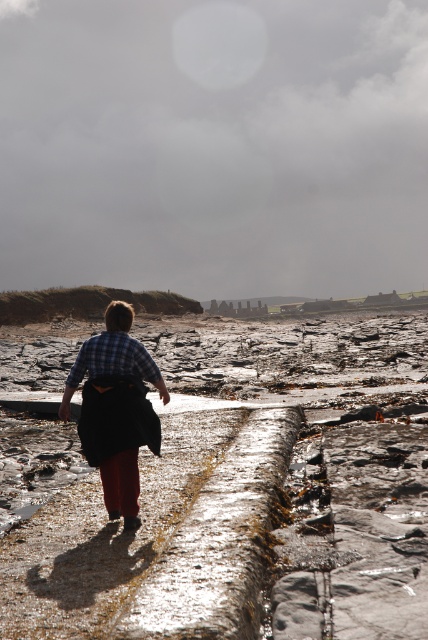
You are standing at the starting point and want to walk towards the distant horizon. You see the smooth stone path at center and the plaid fabric shirt at center. Which object should you move towards if you want to follow the path leading away from the camera?

You should move towards the smooth stone path at center because it is to the right of the plaid fabric shirt at center, indicating it is the path leading away from the camera.

You are a hiker planning to cross the smooth stone path at center and the plaid fabric shirt at center. Which object is bigger in size?

The smooth stone path at center is larger in size than the plaid fabric shirt at center.

You are a hiker planning to cross the smooth stone path at center while wearing the plaid fabric shirt at center. Considering the width of the path, will you have enough space to walk comfortably without stepping off the path?

The smooth stone path at center is wider than the plaid fabric shirt at center, so yes, you will have enough space to walk comfortably without stepping off the path.